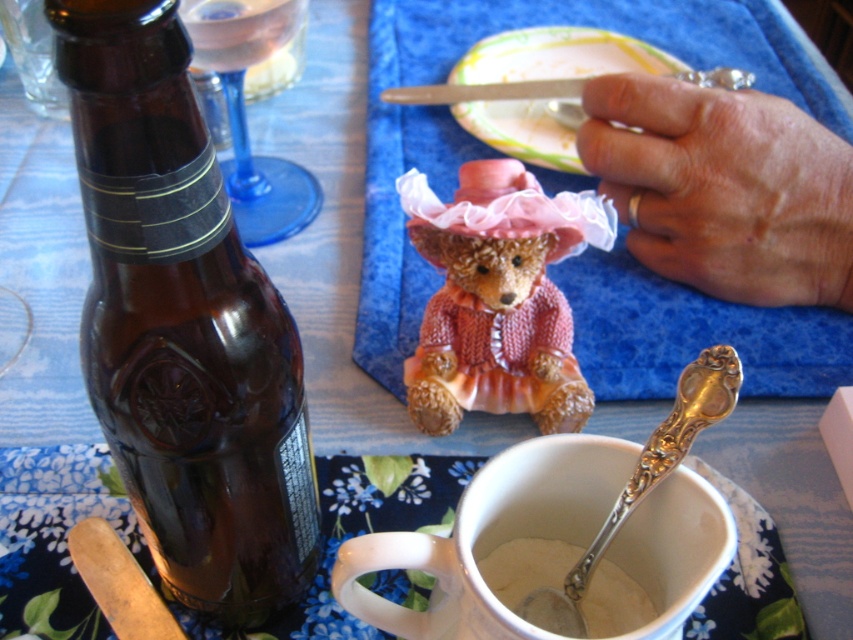
You are a chef preparing a meal and need to pour the contents of the brown glass bottle at left into the white creamy substance at cup center. Will the bottle fit into the cup without spilling?

The brown glass bottle at left might be wider than the white creamy substance at cup center, so there is a possibility that pouring could cause spillage if the bottle opening is too wide for the cup.

You are setting up a small table for a tea party and need to place the pink fabric figurine at center and the white ceramic mug at lower center. The tea party requires that the distance between them must be exactly 12 inches. Based on the current setup, will you need to adjust their positions?

The pink fabric figurine at center and white ceramic mug at lower center are currently 13.03 inches apart. Since the required distance is 12 inches, you need to move them closer by approximately 1.03 inches to meet the requirement.

You are a server setting up a table for a customer. The brown glass bottle at left and the pink knitted bear at center are part of the table setting. The customer has requested that the distance between the bottle and the bear be exactly 6 inches. Based on the current setup, do you need to adjust their positions?

The brown glass bottle at left and pink knitted bear at center are currently 5.84 inches apart. Since the customer requested exactly 6 inches, you need to move them slightly apart to meet the requirement.